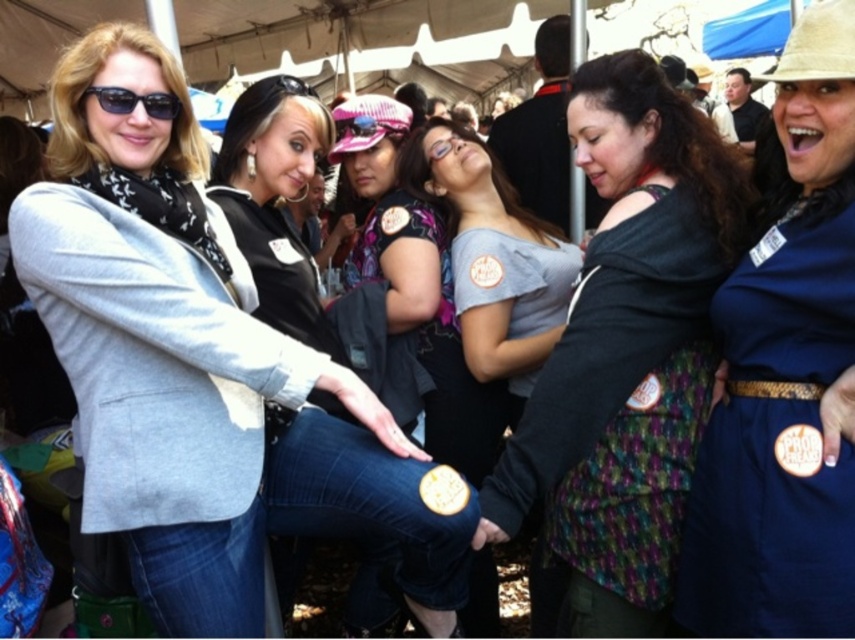
Looking at this image, you are organizing a charity event and need to arrange items on a shelf. You have the blue fabric dress at center and the black plastic sunglasses at upper left. Which item requires more horizontal space on the shelf?

The blue fabric dress at center requires more horizontal space because its width is larger than the black plastic sunglasses at upper left.

You are organizing a clothing donation drive and need to determine which item takes up more space in the donation box. Based on the image, which item between the multicolored fabric vest at center and the blue fabric dress at center is larger in size?

The multicolored fabric vest at center is bigger than the blue fabric dress at center, so it takes up more space in the donation box.

You are a photographer at the event and need to capture a photo that includes both the matte gray blazer at left and the multicolored fabric vest at center. What is the minimum distance you need to move backward to ensure both items are in frame?

The matte gray blazer at left and multicolored fabric vest at center are 28.35 inches apart. To include both in the frame, you need to move back enough so that your camera can capture a field of view that spans at least 28.35 inches between them.